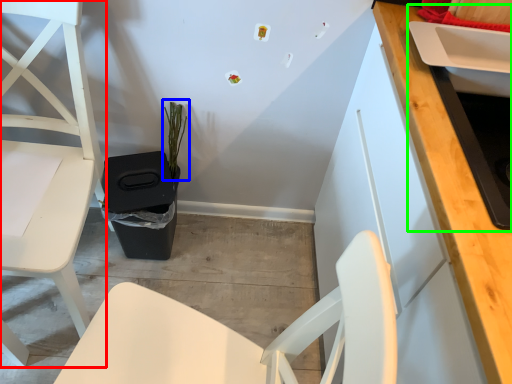
Question: Considering the real-world distances, which object is farthest from chair (highlighted by a red box)? plant (highlighted by a blue box) or sink (highlighted by a green box)?

Choices:
 (A) plant
 (B) sink

Answer: (B)